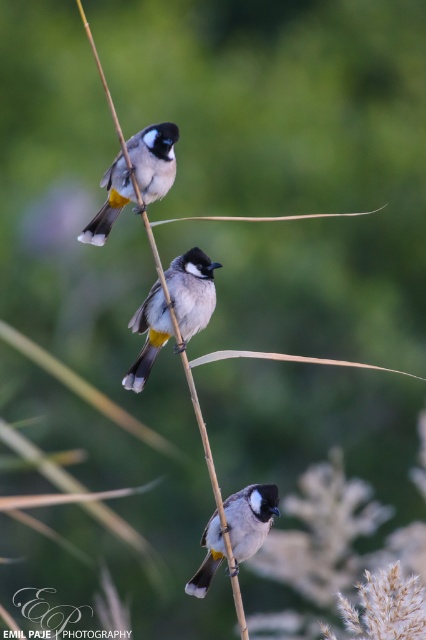
Question: Which of the following is the closest to the observer?

Choices:
 (A) gray matte bird at center
 (B) white matte bird at upper center
 (C) white matte bird at center

Answer: (C)

Question: Is gray matte bird at center positioned in front of white matte bird at upper center?

Choices:
 (A) no
 (B) yes

Answer: (A)

Question: Considering the real-world distances, which object is closest to the white matte bird at upper center?

Choices:
 (A) gray matte bird at center
 (B) white matte bird at center

Answer: (A)

Question: Which point is farther to the camera?

Choices:
 (A) white matte bird at upper center
 (B) white matte bird at center

Answer: (A)

Question: Where is gray matte bird at center located in relation to white matte bird at upper center in the image?

Choices:
 (A) above
 (B) below

Answer: (B)

Question: Is white matte bird at upper center to the right of white matte bird at center from the viewer's perspective?

Choices:
 (A) yes
 (B) no

Answer: (B)